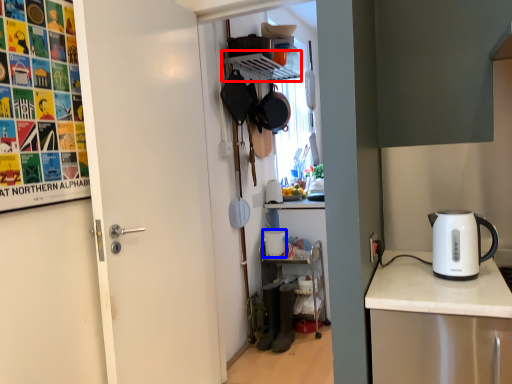
Question: Among these objects, which one is farthest to the camera, shelf (highlighted by a red box) or appliance (highlighted by a blue box)?

Choices:
 (A) shelf
 (B) appliance

Answer: (B)